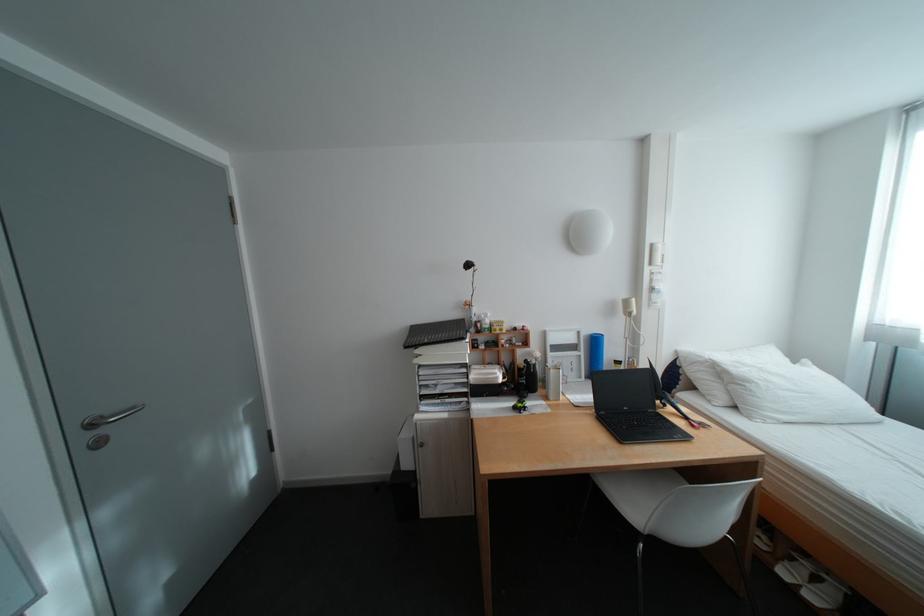
Locate an element on the screen. The image size is (924, 616). light switch is located at coordinates (657, 254).